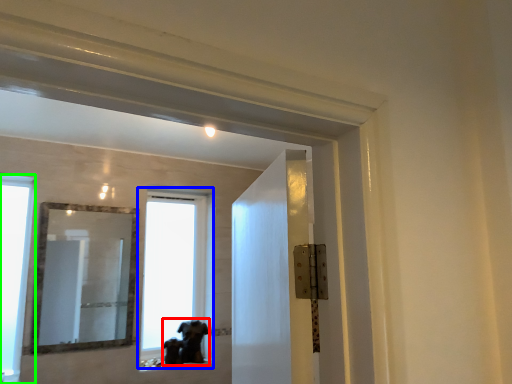
Question: Which object is positioned farthest from animal (highlighted by a red box)? Select from window (highlighted by a blue box) and window (highlighted by a green box).

Choices:
 (A) window
 (B) window

Answer: (A)